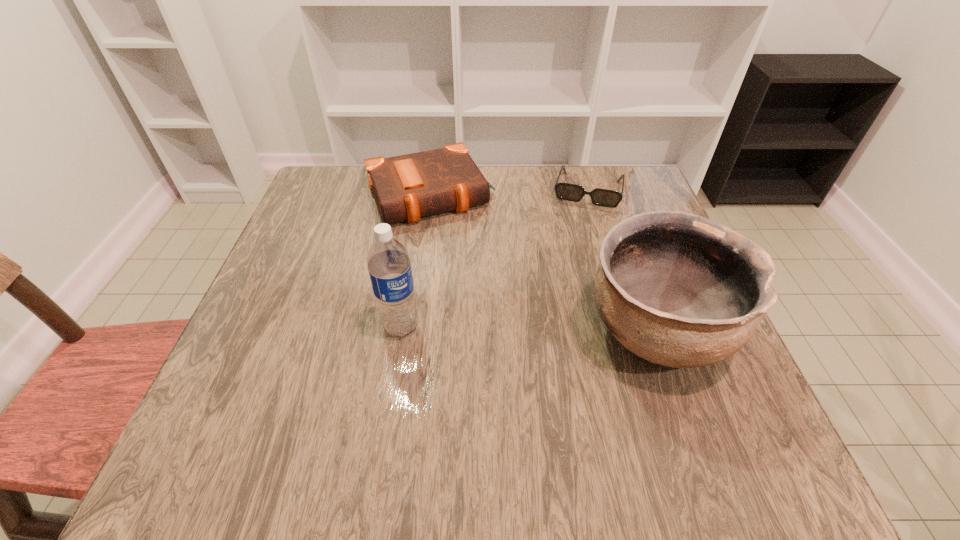
The image size is (960, 540). I want to click on free spot on the desktop that is between the water bottle and the third shortest object and is positioned on the front-facing side of the sunglasses, so click(x=557, y=329).

The image size is (960, 540). In order to click on free spot on the desktop that is between the water bottle and the third shortest object and is positioned on the spine side of the third tallest object in this screenshot , I will do `click(495, 328)`.